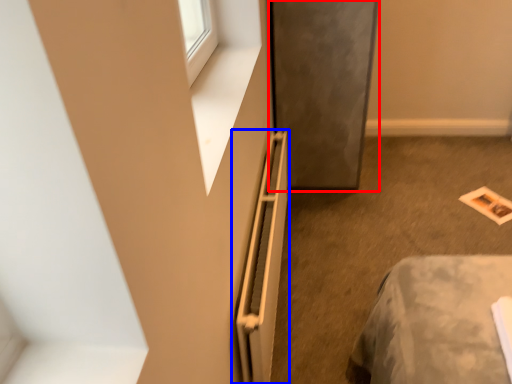
Question: Which point is closer to the camera, screen door (highlighted by a red box) or radiator (highlighted by a blue box)?

Choices:
 (A) screen door
 (B) radiator

Answer: (B)